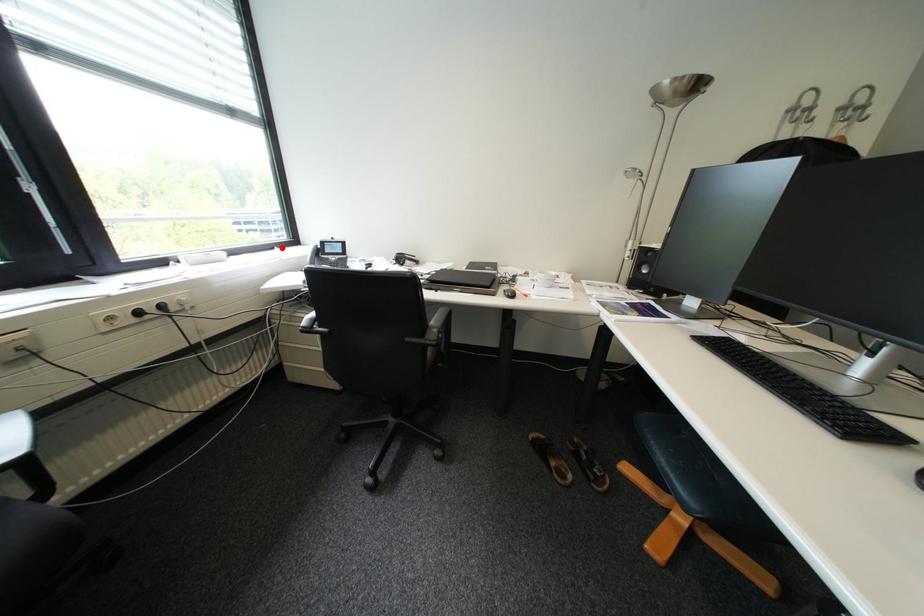
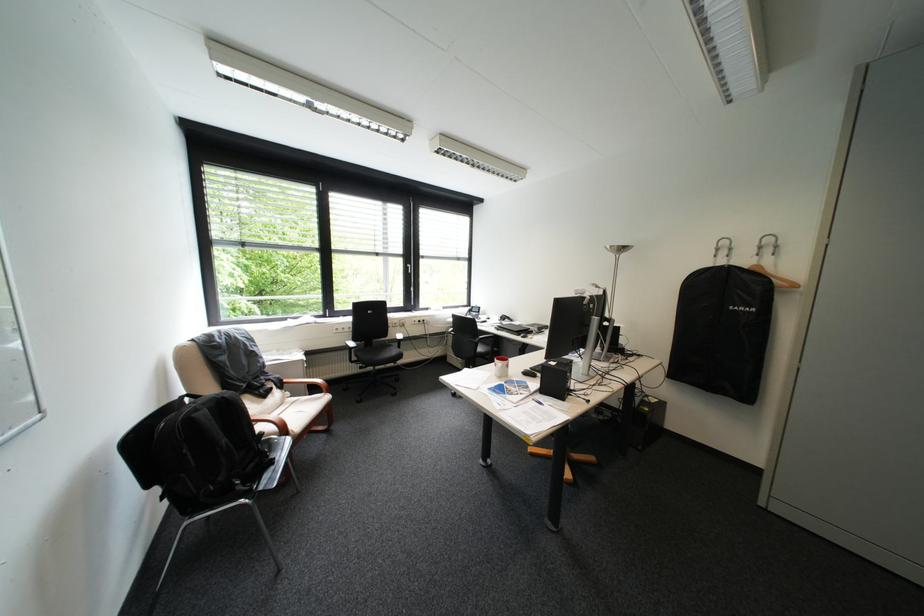
In the second image, find the point that corresponds to the highlighted location in the first image.

(469, 307)